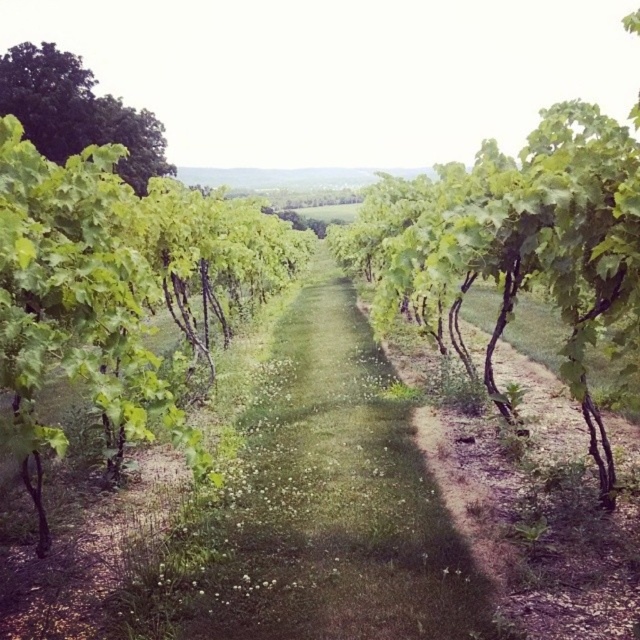
You are standing at the entrance of the vineyard and want to reach the green leafy tree at center. According to the coordinates provided, in which direction should you walk from your current position to reach the tree?

The green leafy tree at center is located at coordinates point (115,291). Since you are at the entrance, which is likely at the edge of the vineyard, you should walk towards the center of the vineyard to reach the tree.